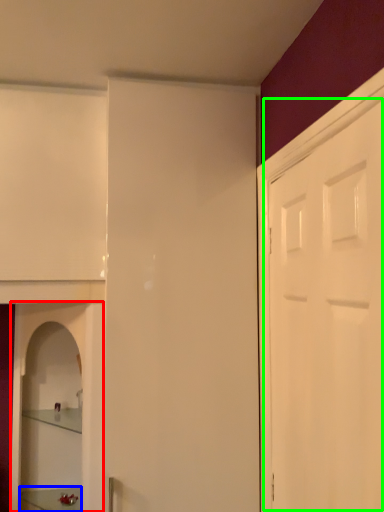
Question: Estimate the real-world distances between objects in this image. Which object is farther from cabinetry (highlighted by a red box), furniture (highlighted by a blue box) or door (highlighted by a green box)?

Choices:
 (A) furniture
 (B) door

Answer: (B)